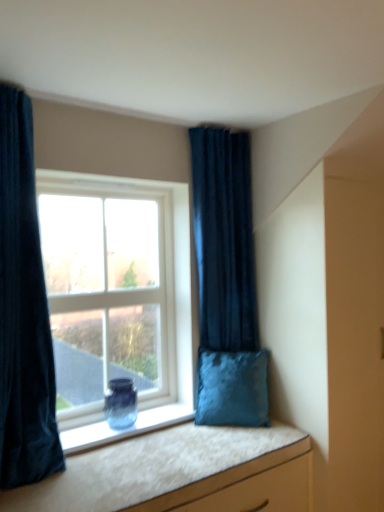
The width and height of the screenshot is (384, 512). Describe the element at coordinates (224, 240) in the screenshot. I see `velvet dark blue curtain at upper right, the second curtain positioned from the left` at that location.

The height and width of the screenshot is (512, 384). What do you see at coordinates (23, 311) in the screenshot? I see `velvet dark blue curtain at left, the 1th curtain viewed from the front` at bounding box center [23, 311].

At what (x,y) coordinates should I click in order to perform the action: click on velvety blue cushion at right. Please return your answer as a coordinate pair (x, y). This screenshot has width=384, height=512. Looking at the image, I should click on (232, 388).

Measure the distance between blue glass vase at window and camera.

2.20 meters.

At what (x,y) coordinates should I click in order to perform the action: click on velvet dark blue curtain at upper right, which appears as the second curtain when viewed from the front. Please return your answer as a coordinate pair (x, y). The image size is (384, 512). Looking at the image, I should click on (224, 240).

From the image's perspective, between velvet dark blue curtain at left, placed as the second curtain when sorted from right to left, and velvety blue cushion at right, which one is located above?

velvet dark blue curtain at left, placed as the second curtain when sorted from right to left, appears higher in the image.

Is velvety blue cushion at right located within velvet dark blue curtain at left, the 1th curtain viewed from the front?

No, velvety blue cushion at right is not inside velvet dark blue curtain at left, the 1th curtain viewed from the front.

From a real-world perspective, is velvet dark blue curtain at left, marked as the 2th curtain in a back-to-front arrangement, below velvety blue cushion at right?

Actually, velvet dark blue curtain at left, marked as the 2th curtain in a back-to-front arrangement, is physically above velvety blue cushion at right in the real world.

Between blue glass vase at window and velvet dark blue curtain at upper right, which is the first curtain from right to left, which one appears on the right side from the viewer's perspective?

velvet dark blue curtain at upper right, which is the first curtain from right to left.

Is velvet dark blue curtain at upper right, which is the first curtain from right to left, surrounded by blue glass vase at window?

No.

Considering the relative sizes of blue glass vase at window and velvet dark blue curtain at upper right, which appears as the second curtain when viewed from the front, in the image provided, is blue glass vase at window taller than velvet dark blue curtain at upper right, which appears as the second curtain when viewed from the front,?

Incorrect, the height of blue glass vase at window is not larger of that of velvet dark blue curtain at upper right, which appears as the second curtain when viewed from the front.

In the scene shown: Is velvet dark blue curtain at left, the 1th curtain viewed from the front, taller or shorter than clear glass window at center?

Considering their sizes, velvet dark blue curtain at left, the 1th curtain viewed from the front, has more height than clear glass window at center.

Considering the relative sizes of velvet dark blue curtain at left, marked as the 2th curtain in a back-to-front arrangement, and clear glass window at center in the image provided, is velvet dark blue curtain at left, marked as the 2th curtain in a back-to-front arrangement, wider than clear glass window at center?

Yes.

Could you measure the distance between velvet dark blue curtain at left, the 1th curtain viewed from the front, and clear glass window at center?

velvet dark blue curtain at left, the 1th curtain viewed from the front, and clear glass window at center are 19.87 inches apart.

Is velvet dark blue curtain at left, the 1th curtain viewed from the front, not near clear glass window at center?

velvet dark blue curtain at left, the 1th curtain viewed from the front, is actually quite close to clear glass window at center.

From a real-world perspective, between velvety blue cushion at right and clear glass window at center, who is vertically higher?

clear glass window at center, from a real-world perspective.

Where is `pillow behind the clear glass window at center`? This screenshot has width=384, height=512. pillow behind the clear glass window at center is located at coordinates (232, 388).

Does velvety blue cushion at right have a greater width compared to clear glass window at center?

Indeed, velvety blue cushion at right has a greater width compared to clear glass window at center.

Based on their sizes in the image, would you say velvety blue cushion at right is bigger or smaller than clear glass window at center?

Considering their sizes, velvety blue cushion at right takes up less space than clear glass window at center.

Can we say velvet dark blue curtain at left, the 1th curtain viewed from the front, lies outside blue glass vase at window?

That's correct, velvet dark blue curtain at left, the 1th curtain viewed from the front, is outside of blue glass vase at window.

Is blue glass vase at window at the back of velvet dark blue curtain at left, marked as the 2th curtain in a back-to-front arrangement?

No, velvet dark blue curtain at left, marked as the 2th curtain in a back-to-front arrangement, is not facing the opposite direction of blue glass vase at window.

Are velvet dark blue curtain at left, the 1th curtain viewed from the front, and blue glass vase at window making contact?

No, velvet dark blue curtain at left, the 1th curtain viewed from the front, is not touching blue glass vase at window.

Which object is further away from the camera, blue glass vase at window or velvet dark blue curtain at left, placed as the second curtain when sorted from right to left?

Positioned behind is blue glass vase at window.

Is blue glass vase at window far away from velvet dark blue curtain at left, the 1th curtain viewed from the front?

Actually, blue glass vase at window and velvet dark blue curtain at left, the 1th curtain viewed from the front, are a little close together.

How distant is blue glass vase at window from velvet dark blue curtain at left, the 1th curtain viewed from the front?

The distance of blue glass vase at window from velvet dark blue curtain at left, the 1th curtain viewed from the front, is 24.99 inches.

From a real-world perspective, starting from the blue glass vase at window, which curtain is the 1st one vertically above it? Please provide its 2D coordinates.

[(23, 311)]

From the picture: Is white textured vanity at lower right oriented away from velvety blue cushion at right?

That's not correct — white textured vanity at lower right is not looking away from velvety blue cushion at right.

Would you say white textured vanity at lower right is outside velvety blue cushion at right?

Yes, white textured vanity at lower right is outside of velvety blue cushion at right.

Between white textured vanity at lower right and velvety blue cushion at right, which one has smaller width?

velvety blue cushion at right.

In order to click on curtain in front of the velvety blue cushion at right in this screenshot , I will do 23,311.

Where is `vase below the velvet dark blue curtain at upper right, which ranks as the 1th curtain in back-to-front order (from a real-world perspective)`? The image size is (384, 512). vase below the velvet dark blue curtain at upper right, which ranks as the 1th curtain in back-to-front order (from a real-world perspective) is located at coordinates (120, 403).

When comparing their distances from velvet dark blue curtain at left, the 1th curtain viewed from the front, does velvet dark blue curtain at upper right, which is the first curtain from right to left, or blue glass vase at window seem further?

velvet dark blue curtain at upper right, which is the first curtain from right to left, lies further to velvet dark blue curtain at left, the 1th curtain viewed from the front, than the other object.

From the image, which object appears to be farther from white textured vanity at lower right, velvet dark blue curtain at left, marked as the 2th curtain in a back-to-front arrangement, or clear glass window at center?

Among the two, clear glass window at center is located further to white textured vanity at lower right.

Estimate the real-world distances between objects in this image. Which object is further from white textured vanity at lower right, clear glass window at center or velvet dark blue curtain at left, the 1th curtain viewed from the front?

clear glass window at center is further to white textured vanity at lower right.

Estimate the real-world distances between objects in this image. Which object is further from blue glass vase at window, white textured vanity at lower right or velvet dark blue curtain at left, acting as the first curtain starting from the left?

velvet dark blue curtain at left, acting as the first curtain starting from the left, lies further to blue glass vase at window than the other object.

Estimate the real-world distances between objects in this image. Which object is further from blue glass vase at window, velvet dark blue curtain at upper right, the second curtain positioned from the left, or white textured vanity at lower right?

velvet dark blue curtain at upper right, the second curtain positioned from the left, lies further to blue glass vase at window than the other object.

Which object lies further to the anchor point velvet dark blue curtain at upper right, which is the first curtain from right to left, blue glass vase at window or white textured vanity at lower right?

white textured vanity at lower right is positioned further to the anchor velvet dark blue curtain at upper right, which is the first curtain from right to left.

Considering their positions, is blue glass vase at window positioned further to white textured vanity at lower right than velvet dark blue curtain at left, the 1th curtain viewed from the front?

velvet dark blue curtain at left, the 1th curtain viewed from the front.

Based on their spatial positions, is velvet dark blue curtain at left, marked as the 2th curtain in a back-to-front arrangement, or clear glass window at center closer to blue glass vase at window?

The object closer to blue glass vase at window is clear glass window at center.

I want to click on window positioned between white textured vanity at lower right and velvety blue cushion at right from near to far, so click(113, 287).

Identify the location of curtain between velvet dark blue curtain at left, the 1th curtain viewed from the front, and velvety blue cushion at right. (224, 240).

You are a GUI agent. You are given a task and a screenshot of the screen. Output one action in this format:
    pyautogui.click(x=<x>, y=<y>)
    Task: Click on the vase between velvet dark blue curtain at left, acting as the first curtain starting from the left, and white textured vanity at lower right from top to bottom
    This screenshot has height=512, width=384.
    Given the screenshot: What is the action you would take?
    pyautogui.click(x=120, y=403)

Locate an element on the screen. The image size is (384, 512). pillow located between white textured vanity at lower right and velvet dark blue curtain at upper right, the second curtain positioned from the left, in the depth direction is located at coordinates (232, 388).